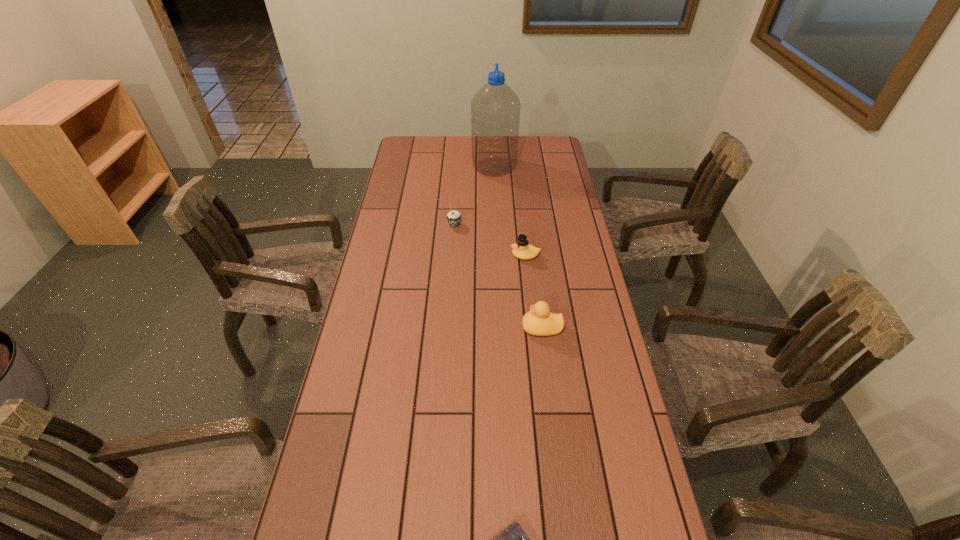
Where is `vacant space located 0.140m on the face of the second tallest object`? The image size is (960, 540). vacant space located 0.140m on the face of the second tallest object is located at coordinates (474, 328).

Where is `blank area located on the front-facing side of the shorter duck`? blank area located on the front-facing side of the shorter duck is located at coordinates (449, 256).

What are the coordinates of `vacant space located on the front-facing side of the shorter duck` in the screenshot? It's located at (425, 256).

Image resolution: width=960 pixels, height=540 pixels. I want to click on free space located 0.220m on the front-facing side of the shorter duck, so click(x=446, y=256).

Identify the location of free region located on the left of the fourth nearest object. (427, 225).

What are the coordinates of `object that is positioned at the far edge` in the screenshot? It's located at (495, 109).

Identify the location of vacant space at the far edge of the desktop. The height and width of the screenshot is (540, 960). (441, 159).

Find the location of a particular element. free space at the left edge of the desktop is located at coordinates (408, 332).

Identify the location of free space at the right edge. (569, 229).

You are a GUI agent. You are given a task and a screenshot of the screen. Output one action in this format:
    pyautogui.click(x=<x>, y=<y>)
    Task: Click on the vacant region at the far right corner of the desktop
    
    Given the screenshot: What is the action you would take?
    pyautogui.click(x=544, y=139)